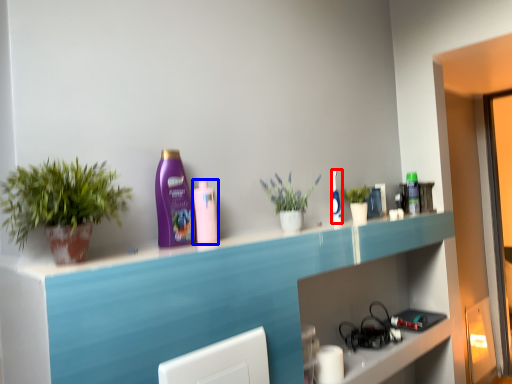
Question: Which object appears closest to the camera in this image, mouthwash (highlighted by a red box) or mouthwash (highlighted by a blue box)?

Choices:
 (A) mouthwash
 (B) mouthwash

Answer: (B)